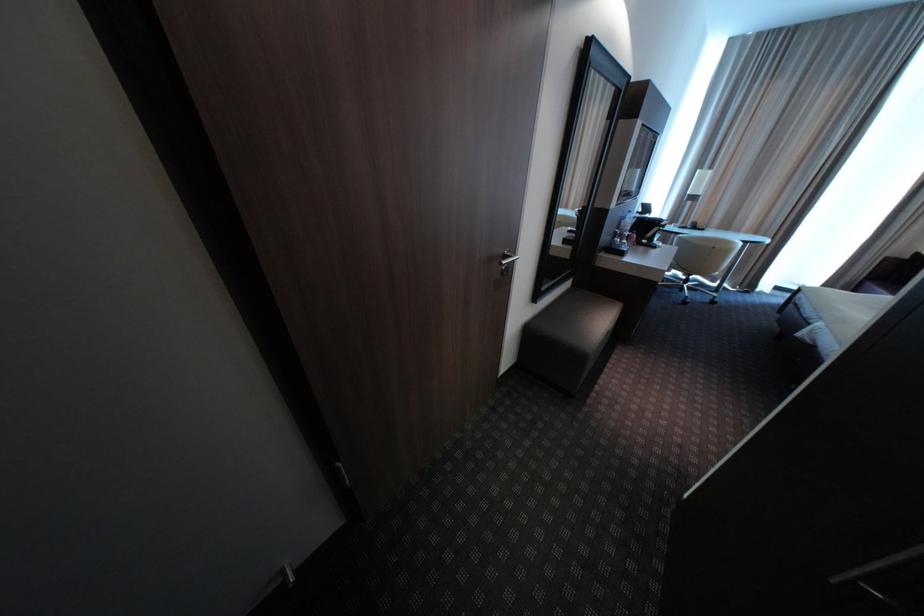
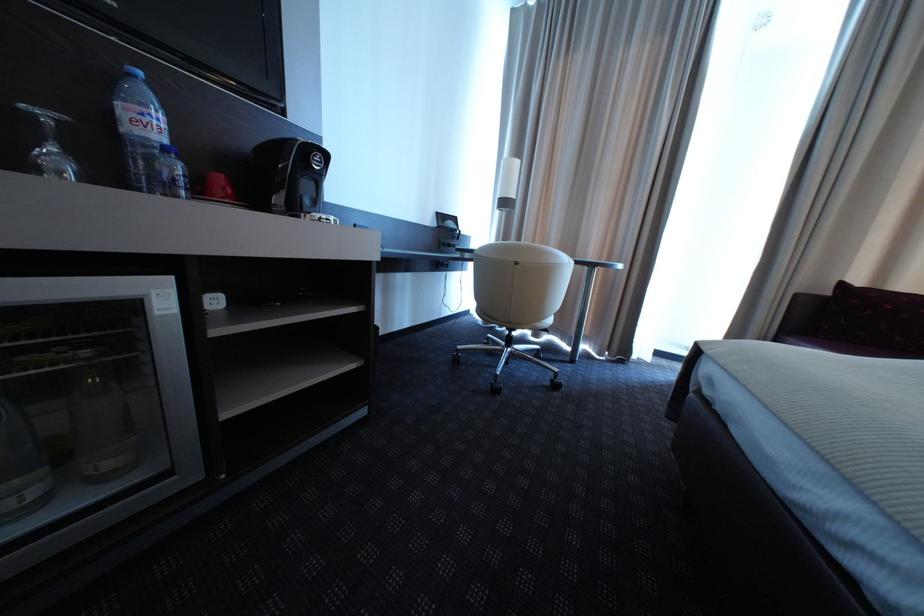
In the scene shown: The images are taken continuously from a first-person perspective. In which direction are you moving?

The cameraman moved toward right, forward.